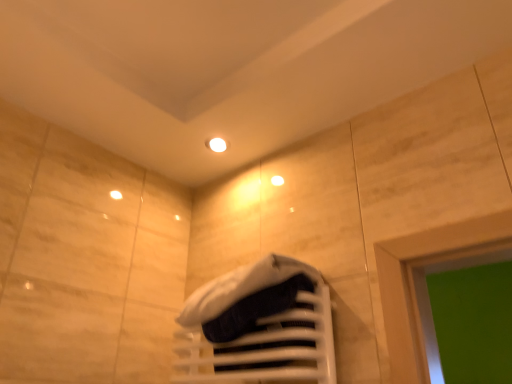
Locate an element on the screen. The height and width of the screenshot is (384, 512). white matte towel rack at lower center is located at coordinates (259, 325).

Describe the element at coordinates (259, 325) in the screenshot. I see `white matte towel rack at lower center` at that location.

Identify the location of white matte towel rack at lower center. (259, 325).